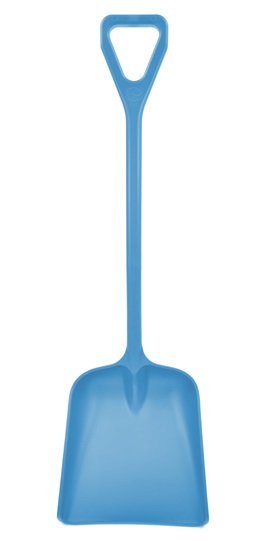
Find the location of a particular element. The height and width of the screenshot is (541, 272). toy is located at coordinates (118, 464).